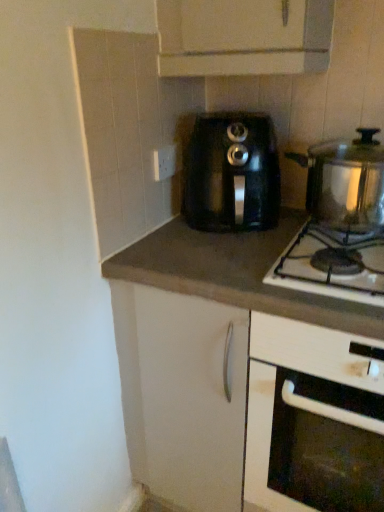
At what (x,y) coordinates should I click in order to perform the action: click on unoccupied area in front of black plastic coffee maker at center, which is counted as the 1th kitchen appliance, starting from the left. Please return your answer as a coordinate pair (x, y). Looking at the image, I should click on (209, 257).